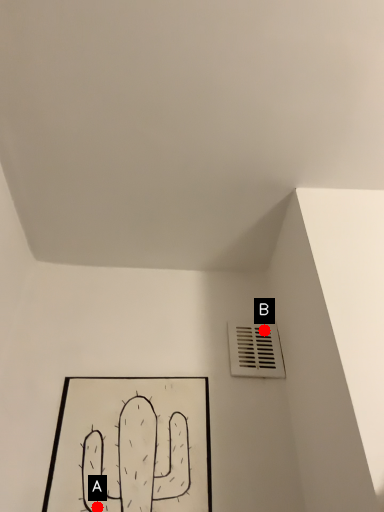
Question: Two points are circled on the image, labeled by A and B beside each circle. Which point is farther to the camera?

Choices:
 (A) A is further
 (B) B is further

Answer: (B)